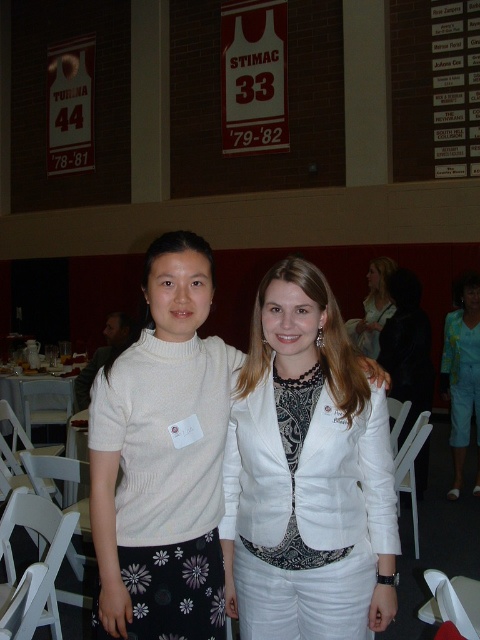
Question: Is light blue fabric pants at lower right smaller than light brown hair at upper right?

Choices:
 (A) no
 (B) yes

Answer: (A)

Question: Can you confirm if white leather blazer at center is smaller than white plastic table at lower left?

Choices:
 (A) yes
 (B) no

Answer: (A)

Question: Which point is farther to the camera?

Choices:
 (A) light brown hair at upper right
 (B) light blue fabric pants at lower right
 (C) white matte sweater at center

Answer: (B)

Question: Can you confirm if white leather blazer at center is thinner than light brown hair at upper right?

Choices:
 (A) yes
 (B) no

Answer: (B)

Question: Among these points, which one is nearest to the camera?

Choices:
 (A) (181, 516)
 (B) (357, 337)
 (C) (67, 424)

Answer: (A)

Question: Which object is positioned closest to the light brown hair at upper right?

Choices:
 (A) white leather blazer at center
 (B) white plastic table at lower left
 (C) white matte sweater at center

Answer: (B)